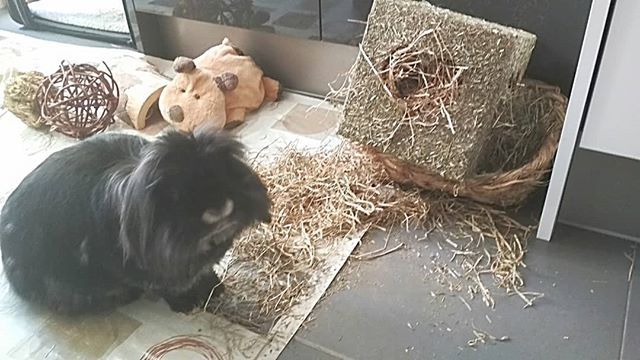
I want to click on brown stuffed animal, so click(188, 96), click(207, 105), click(169, 98), click(195, 78), click(212, 62), click(246, 73).